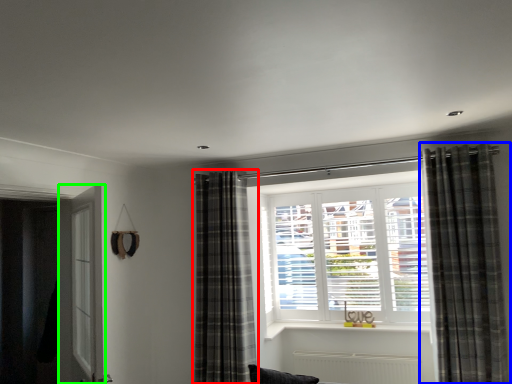
Question: Which is nearer to the curtain (highlighted by a red box)? curtain (highlighted by a blue box) or screen door (highlighted by a green box).

Choices:
 (A) curtain
 (B) screen door

Answer: (B)